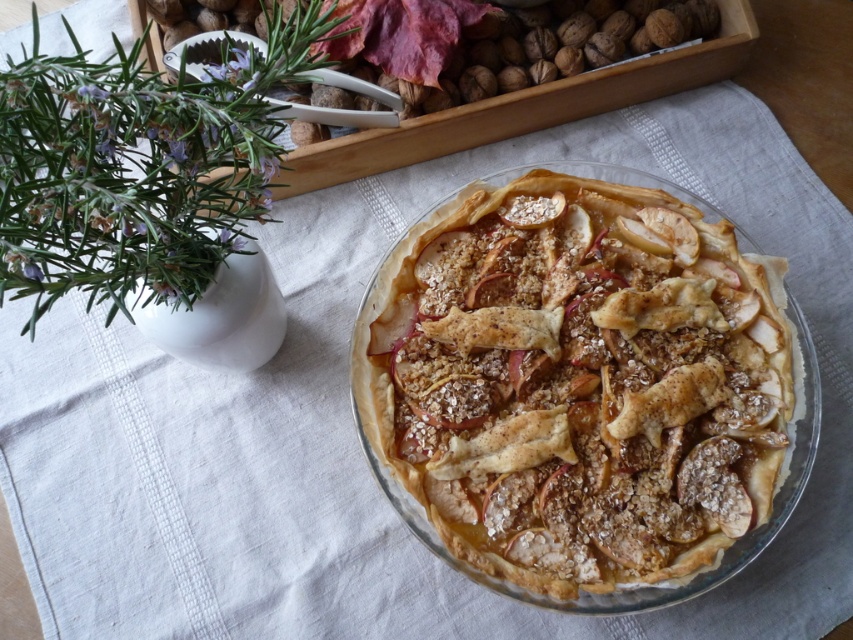
Which is more to the left, golden flaky pie at center or brown textured nuts at upper center?

From the viewer's perspective, brown textured nuts at upper center appears more on the left side.

Based on the photo, which is more to the right, golden flaky pie at center or brown textured nuts at upper center?

Positioned to the right is golden flaky pie at center.

Which is in front, point (538, 172) or point (404, 16)?

Point (538, 172) is in front.

This screenshot has width=853, height=640. I want to click on golden flaky pie at center, so click(x=582, y=388).